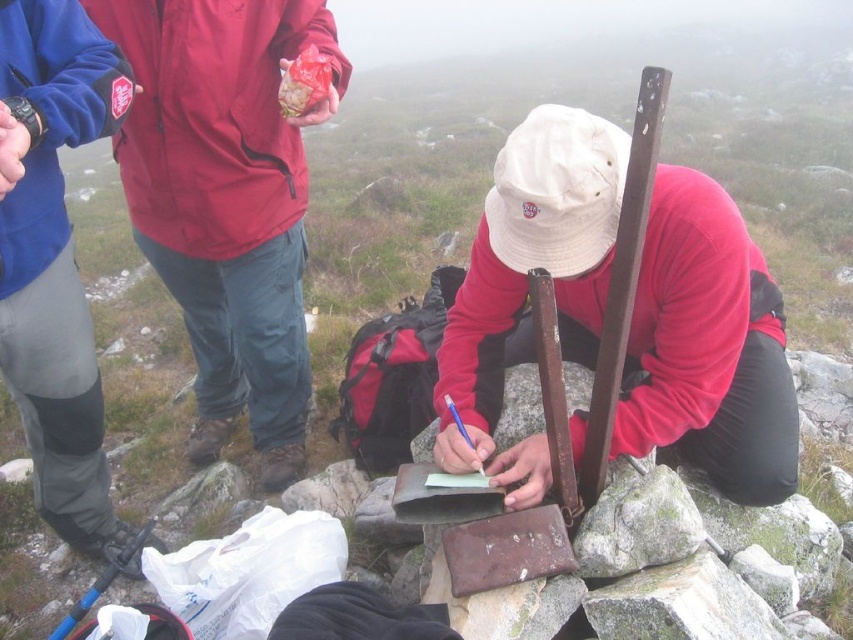
You are standing at the center of the image. Which direction should you move to reach the matte red jacket at left?

The matte red jacket at left is located at the left side of the image, so you should move to the left to reach it.